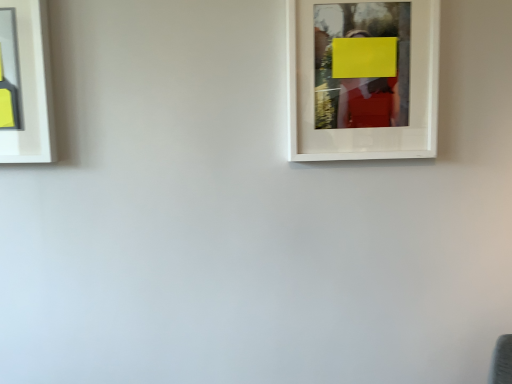
Question: Is white matte picture frame at upper right, placed as the 2th picture frame when sorted from left to right, in front of or behind matte gray picture frame at left, which ranks as the second picture frame in right-to-left order, in the image?

Choices:
 (A) front
 (B) behind

Answer: (A)

Question: From the image's perspective, is white matte picture frame at upper right, placed as the 2th picture frame when sorted from left to right, located above or below matte gray picture frame at left, placed as the first picture frame when sorted from left to right?

Choices:
 (A) above
 (B) below

Answer: (A)

Question: Do you think white matte picture frame at upper right, placed as the 2th picture frame when sorted from left to right, is within matte gray picture frame at left, which ranks as the second picture frame in right-to-left order, or outside of it?

Choices:
 (A) outside
 (B) inside

Answer: (A)

Question: From a real-world perspective, is matte gray picture frame at left, which ranks as the second picture frame in right-to-left order, physically located above or below white matte picture frame at upper right, placed as the 2th picture frame when sorted from left to right?

Choices:
 (A) above
 (B) below

Answer: (A)

Question: Relative to white matte picture frame at upper right, placed as the 2th picture frame when sorted from left to right, is matte gray picture frame at left, which ranks as the second picture frame in right-to-left order, in front or behind?

Choices:
 (A) behind
 (B) front

Answer: (A)

Question: Is matte gray picture frame at left, placed as the first picture frame when sorted from left to right, taller or shorter than white matte picture frame at upper right, placed as the 2th picture frame when sorted from left to right?

Choices:
 (A) tall
 (B) short

Answer: (B)

Question: Is matte gray picture frame at left, placed as the first picture frame when sorted from left to right, situated inside white matte picture frame at upper right, the 1th picture frame positioned from the right, or outside?

Choices:
 (A) inside
 (B) outside

Answer: (B)